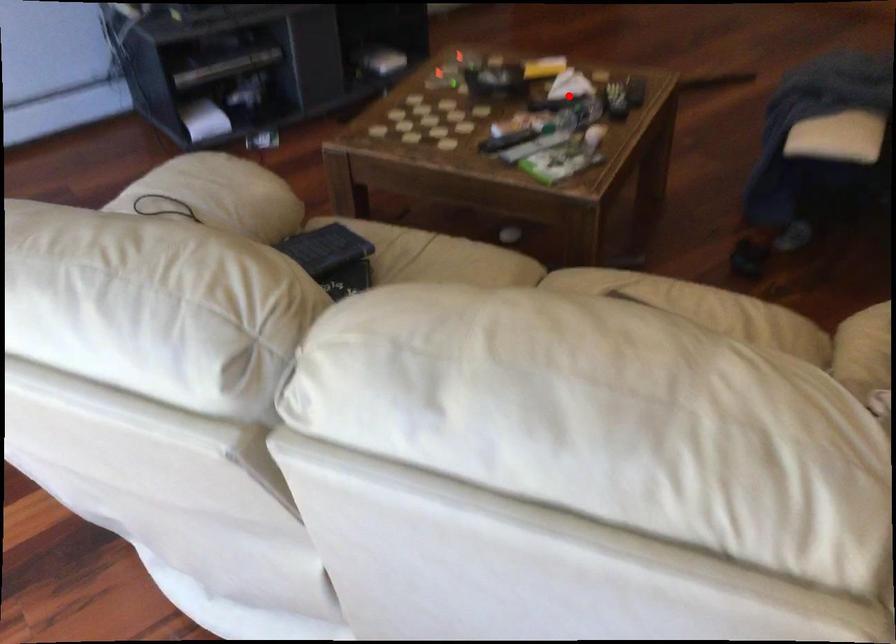
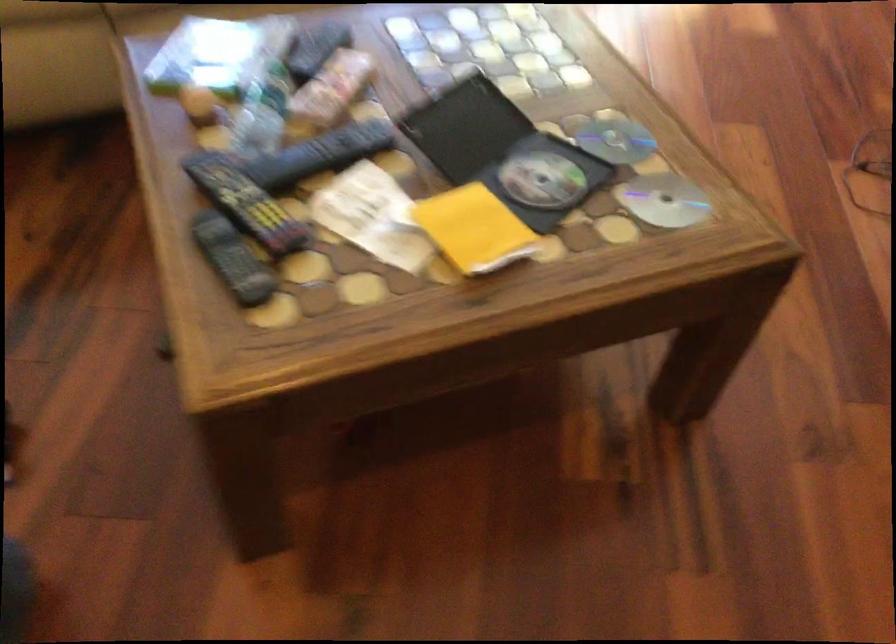
Question: A red point is marked in image1. In image2, is the corresponding 3D point closer to the camera or farther? Reply with the corresponding letter.

Choices:
 (A) The corresponding 3D point is closer.
 (B) The corresponding 3D point is farther.

Answer: (A)